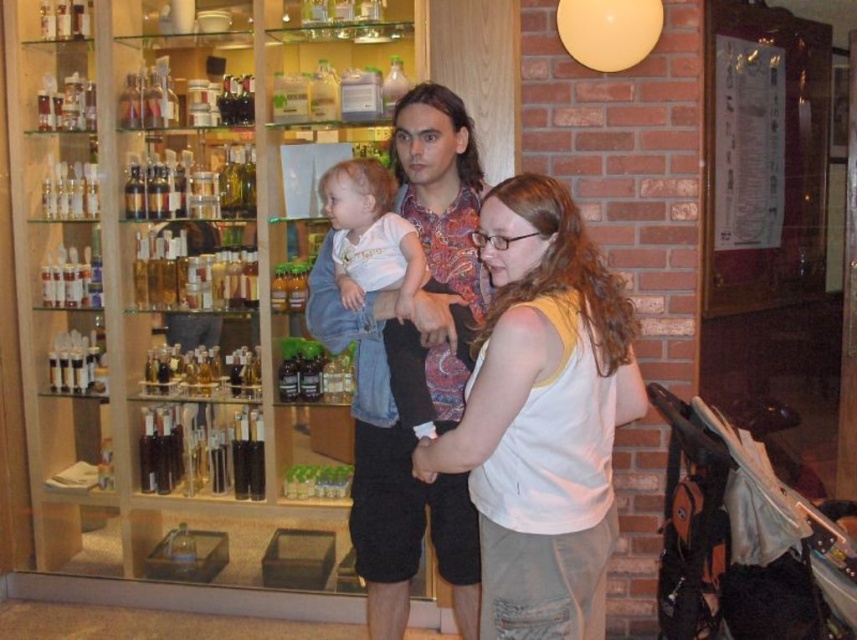
Please look at the image and locate the point at coordinates (412, 369). Based on the scene description, can you tell me what object or surface this point is located on?

The point at coordinates (412, 369) is located on the matte floral shirt at center.

Looking at this image, you are a store employee who needs to restock two items on the shelf. The items are the white cotton tank top at center and the matte floral shirt at center. The shelf has a maximum width of 14 inches. Can both items fit side by side on the shelf without overlapping?

The distance between the white cotton tank top at center and the matte floral shirt at center is 15.22 inches, which exceeds the shelf width of 14 inches. Therefore, both items cannot fit side by side on the shelf without overlapping.